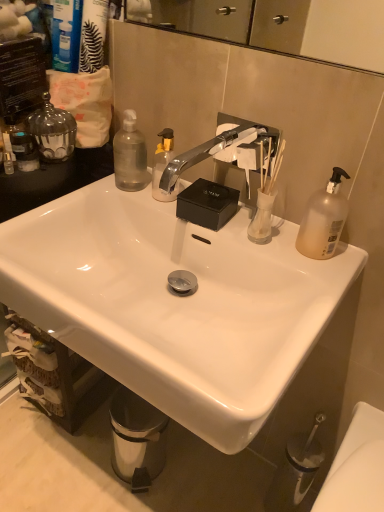
The height and width of the screenshot is (512, 384). I want to click on free space in front of translucent plastic pump bottle at right, the 2th bottle in the left-to-right sequence, so click(x=318, y=284).